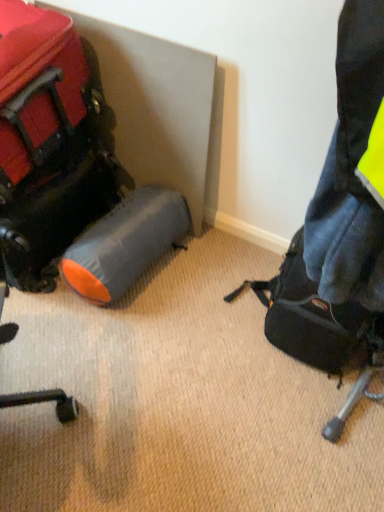
Question: From a real-world perspective, does matte black backpack at right, the 1th luggage and bags positioned from the right, sit lower than gray fabric sleeping bag at lower left?

Choices:
 (A) yes
 (B) no

Answer: (B)

Question: From a real-world perspective, is matte black backpack at right, positioned as the 2th luggage and bags in left-to-right order, on gray fabric sleeping bag at lower left?

Choices:
 (A) yes
 (B) no

Answer: (A)

Question: Is matte black backpack at right, positioned as the 2th luggage and bags in left-to-right order, completely or partially outside of gray fabric sleeping bag at lower left?

Choices:
 (A) yes
 (B) no

Answer: (A)

Question: Is the depth of matte black backpack at right, positioned as the 2th luggage and bags in left-to-right order, less than that of gray fabric sleeping bag at lower left?

Choices:
 (A) yes
 (B) no

Answer: (A)

Question: Is matte black backpack at right, the 1th luggage and bags positioned from the right, smaller than gray fabric sleeping bag at lower left?

Choices:
 (A) no
 (B) yes

Answer: (A)

Question: Is point (91, 291) positioned closer to the camera than point (1, 252)?

Choices:
 (A) farther
 (B) closer

Answer: (A)

Question: Looking at their shapes, would you say gray fabric sleeping bag at lower left is wider or thinner than matte black suitcase at left, which ranks as the 2th luggage and bags in right-to-left order?

Choices:
 (A) thin
 (B) wide

Answer: (A)

Question: Considering the relative positions of gray fabric sleeping bag at lower left and matte black suitcase at left, marked as the first luggage and bags in a left-to-right arrangement, in the image provided, is gray fabric sleeping bag at lower left to the left or to the right of matte black suitcase at left, marked as the first luggage and bags in a left-to-right arrangement,?

Choices:
 (A) right
 (B) left

Answer: (A)

Question: From the image's perspective, is gray fabric sleeping bag at lower left above or below matte black suitcase at left, marked as the first luggage and bags in a left-to-right arrangement?

Choices:
 (A) below
 (B) above

Answer: (A)

Question: In terms of height, does gray fabric sleeping bag at lower left look taller or shorter compared to matte black backpack at right, positioned as the 2th luggage and bags in left-to-right order?

Choices:
 (A) tall
 (B) short

Answer: (B)

Question: Considering the relative positions of gray fabric sleeping bag at lower left and matte black backpack at right, positioned as the 2th luggage and bags in left-to-right order, in the image provided, is gray fabric sleeping bag at lower left to the left or to the right of matte black backpack at right, positioned as the 2th luggage and bags in left-to-right order,?

Choices:
 (A) right
 (B) left

Answer: (B)

Question: From a real-world perspective, is gray fabric sleeping bag at lower left physically located above or below matte black backpack at right, positioned as the 2th luggage and bags in left-to-right order?

Choices:
 (A) below
 (B) above

Answer: (A)

Question: Considering the positions of point (81, 295) and point (327, 320), is point (81, 295) closer or farther from the camera than point (327, 320)?

Choices:
 (A) closer
 (B) farther

Answer: (B)

Question: Considering the positions of matte black backpack at right, positioned as the 2th luggage and bags in left-to-right order, and gray fabric sleeping bag at lower left in the image, is matte black backpack at right, positioned as the 2th luggage and bags in left-to-right order, wider or thinner than gray fabric sleeping bag at lower left?

Choices:
 (A) thin
 (B) wide

Answer: (A)

Question: In terms of height, does matte black backpack at right, positioned as the 2th luggage and bags in left-to-right order, look taller or shorter compared to gray fabric sleeping bag at lower left?

Choices:
 (A) tall
 (B) short

Answer: (A)